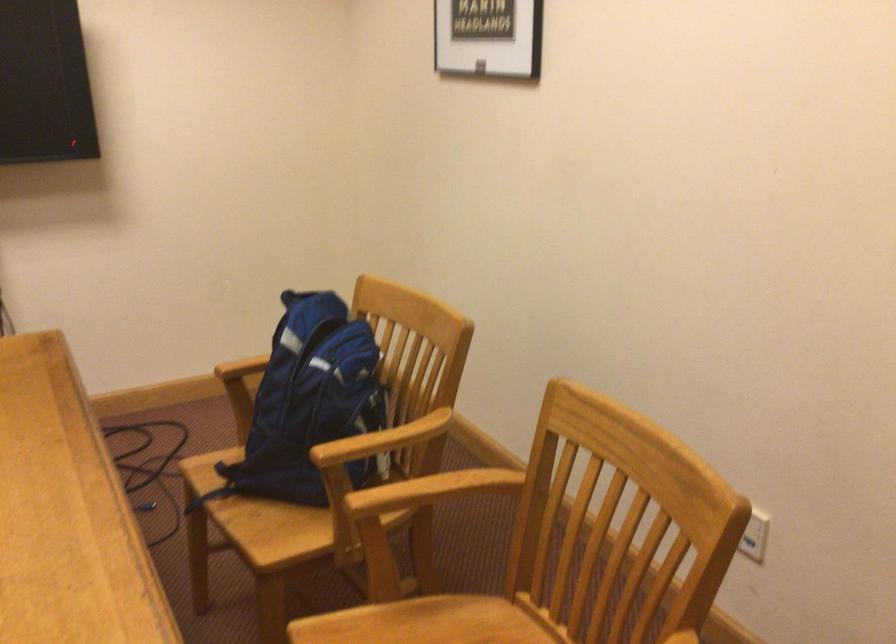
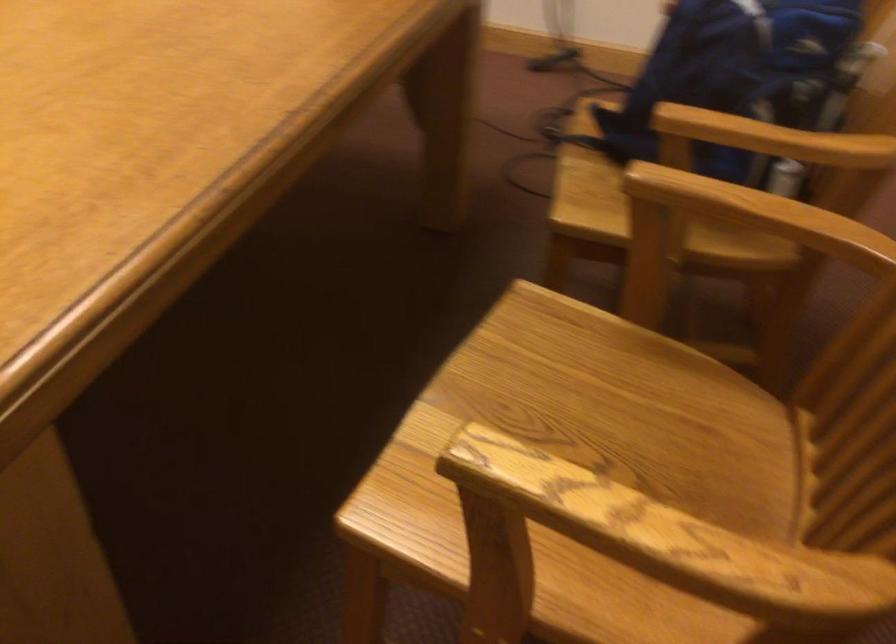
Find the pixel in the second image that matches point (427, 500) in the first image.

(743, 223)